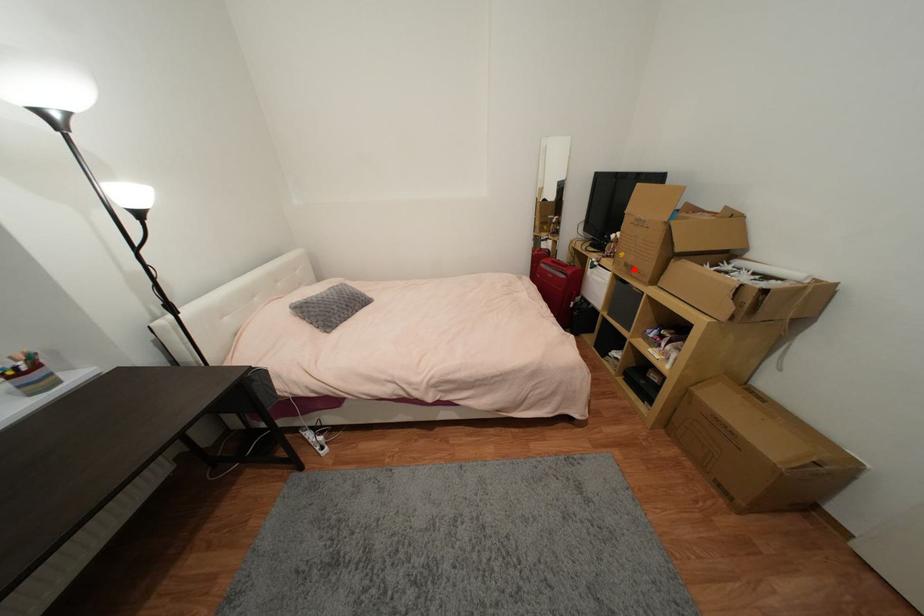
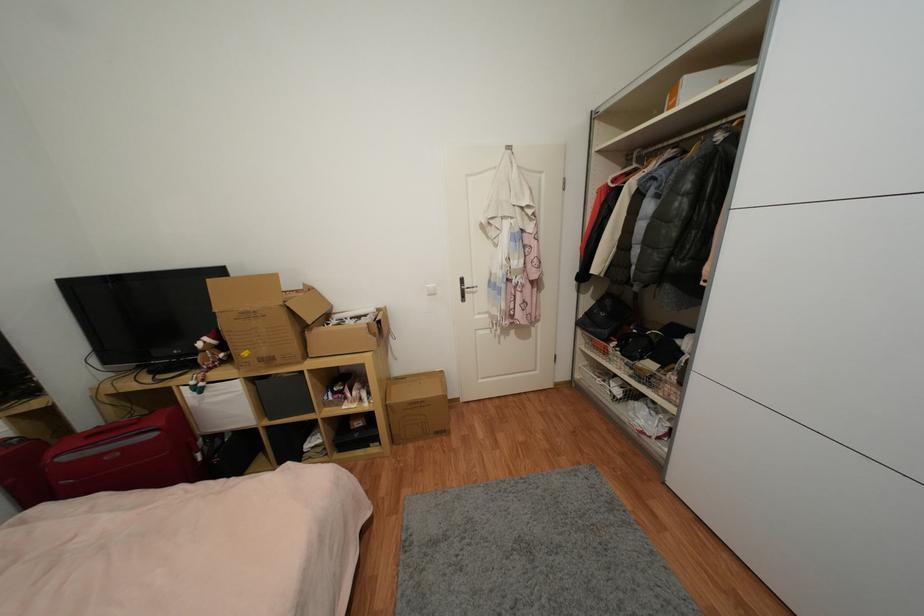
Question: I am providing you with two images of the same scene from different viewpoints. A red point is shown in image1. For the corresponding object point in image2, is it positioned nearer or farther from the camera?

Choices:
 (A) Nearer
 (B) Farther

Answer: (B)